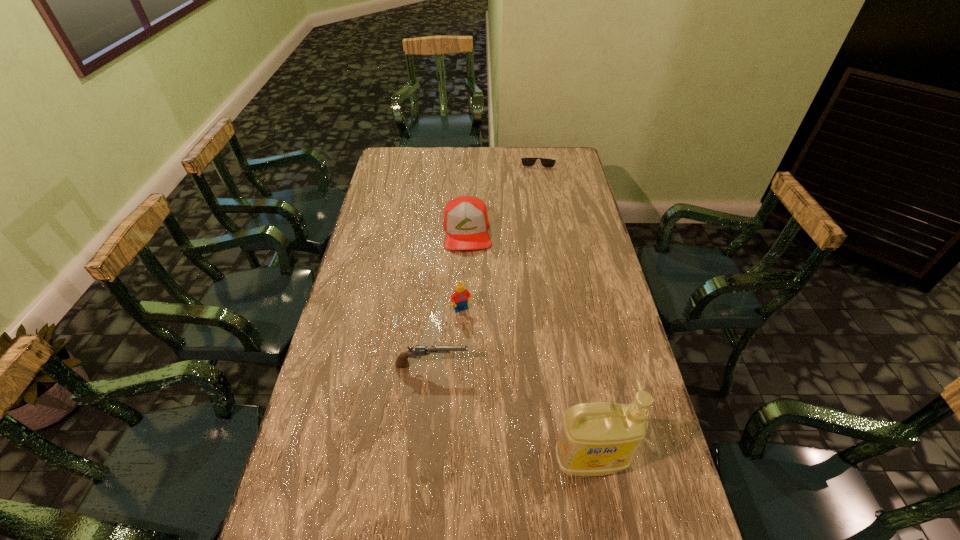
This screenshot has height=540, width=960. I want to click on free space on the desktop that is between the fourth tallest object and the detergent and is positioned on the front-facing side of the fourth nearest object, so click(484, 396).

You are a GUI agent. You are given a task and a screenshot of the screen. Output one action in this format:
    pyautogui.click(x=<x>, y=<y>)
    Task: Click on the free space on the desktop that is between the fourth farthest object and the detergent and is positioned on the face of the third nearest object
    This screenshot has height=540, width=960.
    Given the screenshot: What is the action you would take?
    pyautogui.click(x=513, y=414)

I want to click on free space on the desktop that is between the fourth farthest object and the tallest object and is positioned on the front-facing side of the sunglasses, so click(527, 422).